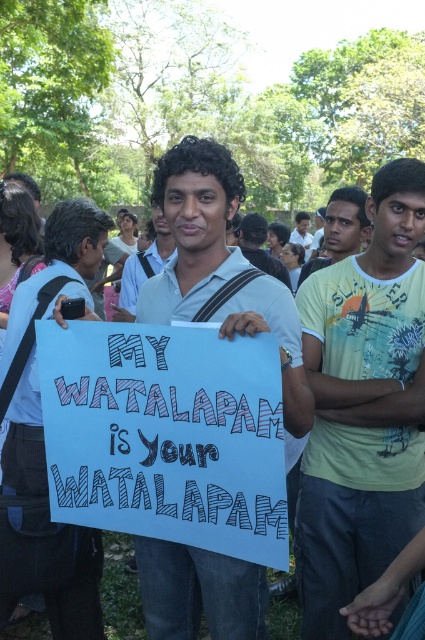
You are a photographer at the event and want to capture both the white cotton shirt at center and the black fabric shirt at center in a single photo. Considering their heights, which shirt will appear shorter in the photo?

The white cotton shirt at center will appear shorter in the photo because it has a lesser height compared to the black fabric shirt at center.

You are a photographer standing 10 feet away from the white cotton shirt at center and black fabric shirt at center. You want to take a photo that includes both shirts without moving your position. Can you fit both shirts into the frame of your camera, which has a maximum horizontal field of view of 50 inches?

The distance between the white cotton shirt at center and black fabric shirt at center is 39.05 inches, which is less than the camera frame of 50 inches. Therefore, both shirts can be captured in the photo without moving your position.

Consider the image. You are a photographer trying to capture a clear shot of the white matte sign at center and the black fabric shirt at center. From the perspective of someone standing in front of the scene, which object is positioned to the left?

The white matte sign at center is to the left of the black fabric shirt at center.